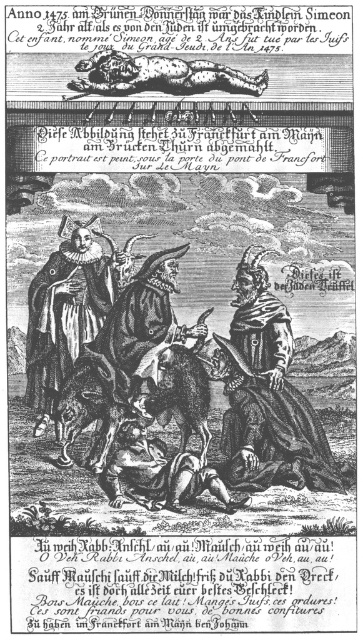
Can you confirm if matte black robe at center is shorter than brown leather boots at lower center?

Incorrect, matte black robe at center's height does not fall short of brown leather boots at lower center's.

Is point (38, 356) in front of point (193, 465)?

No, it is not.

Find the location of `matte black robe at center`. matte black robe at center is located at coordinates (66, 312).

Consider the image. Is matte black robe at center taller than brown leather dog at upper center?

Correct, matte black robe at center is much taller as brown leather dog at upper center.

Measure the distance between point (102, 259) and camera.

93.69 meters

This screenshot has height=640, width=363. In order to click on matte black robe at center in this screenshot , I will do `click(66, 312)`.

Does wooden staff at center appear over matte black robe at center?

Actually, wooden staff at center is below matte black robe at center.

Is point (253, 314) farther from camera compared to point (51, 298)?

That is True.

I want to click on wooden staff at center, so (x=267, y=396).

Locate an element on the screen. Image resolution: width=363 pixels, height=640 pixels. wooden staff at center is located at coordinates (267, 396).